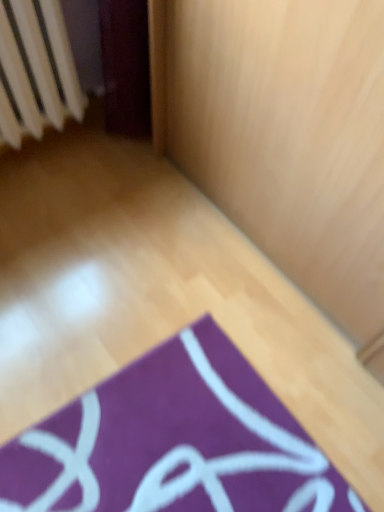
The width and height of the screenshot is (384, 512). What are the coordinates of `purple fabric yoga mat at lower center` in the screenshot? It's located at (174, 442).

The image size is (384, 512). What do you see at coordinates (174, 442) in the screenshot?
I see `purple fabric yoga mat at lower center` at bounding box center [174, 442].

The width and height of the screenshot is (384, 512). What do you see at coordinates (36, 72) in the screenshot?
I see `white plastic radiator at upper left` at bounding box center [36, 72].

What is the approximate width of white plastic radiator at upper left?

white plastic radiator at upper left is 9.41 inches wide.

The width and height of the screenshot is (384, 512). I want to click on white plastic radiator at upper left, so [x=36, y=72].

Where is `purple fabric yoga mat at lower center`? purple fabric yoga mat at lower center is located at coordinates (174, 442).

Between white plastic radiator at upper left and purple fabric yoga mat at lower center, which one appears on the right side from the viewer's perspective?

purple fabric yoga mat at lower center is more to the right.

Relative to purple fabric yoga mat at lower center, is white plastic radiator at upper left in front or behind?

white plastic radiator at upper left is behind purple fabric yoga mat at lower center.

Between point (14, 38) and point (37, 479), which one is positioned behind?

The point (14, 38) is farther from the camera.

From the image's perspective, which object appears higher, white plastic radiator at upper left or purple fabric yoga mat at lower center?

white plastic radiator at upper left appears higher in the image.

From a real-world perspective, is white plastic radiator at upper left located higher than purple fabric yoga mat at lower center?

Yes, from a real-world perspective, white plastic radiator at upper left is above purple fabric yoga mat at lower center.

Can you confirm if white plastic radiator at upper left is wider than purple fabric yoga mat at lower center?

No.

Can you confirm if white plastic radiator at upper left is shorter than purple fabric yoga mat at lower center?

In fact, white plastic radiator at upper left may be taller than purple fabric yoga mat at lower center.

Considering the relative sizes of white plastic radiator at upper left and purple fabric yoga mat at lower center in the image provided, is white plastic radiator at upper left bigger than purple fabric yoga mat at lower center?

Correct, white plastic radiator at upper left is larger in size than purple fabric yoga mat at lower center.

Is white plastic radiator at upper left completely or partially outside of purple fabric yoga mat at lower center?

Yes, white plastic radiator at upper left is located beyond the bounds of purple fabric yoga mat at lower center.

In the scene shown: Is white plastic radiator at upper left next to purple fabric yoga mat at lower center?

No, white plastic radiator at upper left is not making contact with purple fabric yoga mat at lower center.

Is white plastic radiator at upper left facing away from purple fabric yoga mat at lower center?

No, white plastic radiator at upper left is not facing away from purple fabric yoga mat at lower center.

Locate an element on the screen. radiator located above the purple fabric yoga mat at lower center (from a real-world perspective) is located at coordinates (36, 72).

Which object is positioned more to the right, purple fabric yoga mat at lower center or white plastic radiator at upper left?

Positioned to the right is purple fabric yoga mat at lower center.

Who is more distant, purple fabric yoga mat at lower center or white plastic radiator at upper left?

white plastic radiator at upper left.

Which is closer to the camera, (133, 479) or (13, 41)?

Clearly, point (133, 479) is closer to the camera than point (13, 41).

From the picture: From the image's perspective, which object appears higher, purple fabric yoga mat at lower center or white plastic radiator at upper left?

From the image's view, white plastic radiator at upper left is above.

Looking at this image, from a real-world perspective, is purple fabric yoga mat at lower center physically below white plastic radiator at upper left?

Yes, from a real-world perspective, purple fabric yoga mat at lower center is below white plastic radiator at upper left.

Does purple fabric yoga mat at lower center have a lesser width compared to white plastic radiator at upper left?

In fact, purple fabric yoga mat at lower center might be wider than white plastic radiator at upper left.

In terms of height, does purple fabric yoga mat at lower center look taller or shorter compared to white plastic radiator at upper left?

purple fabric yoga mat at lower center is shorter than white plastic radiator at upper left.

Considering the sizes of objects purple fabric yoga mat at lower center and white plastic radiator at upper left in the image provided, who is bigger, purple fabric yoga mat at lower center or white plastic radiator at upper left?

white plastic radiator at upper left is bigger.

Is white plastic radiator at upper left surrounded by purple fabric yoga mat at lower center?

No, white plastic radiator at upper left is not a part of purple fabric yoga mat at lower center.

Is purple fabric yoga mat at lower center placed right next to white plastic radiator at upper left?

No, purple fabric yoga mat at lower center is not with white plastic radiator at upper left.

Based on the photo, is purple fabric yoga mat at lower center oriented towards white plastic radiator at upper left?

No, purple fabric yoga mat at lower center is not aimed at white plastic radiator at upper left.

How different are the orientations of purple fabric yoga mat at lower center and white plastic radiator at upper left in degrees?

1.75 degrees.

Where is `radiator above the purple fabric yoga mat at lower center (from the image's perspective)`? This screenshot has height=512, width=384. radiator above the purple fabric yoga mat at lower center (from the image's perspective) is located at coordinates (36, 72).

Identify the location of yoga mat on the right side of white plastic radiator at upper left. The image size is (384, 512). (174, 442).

Identify the location of radiator above the purple fabric yoga mat at lower center (from a real-world perspective). The height and width of the screenshot is (512, 384). (36, 72).